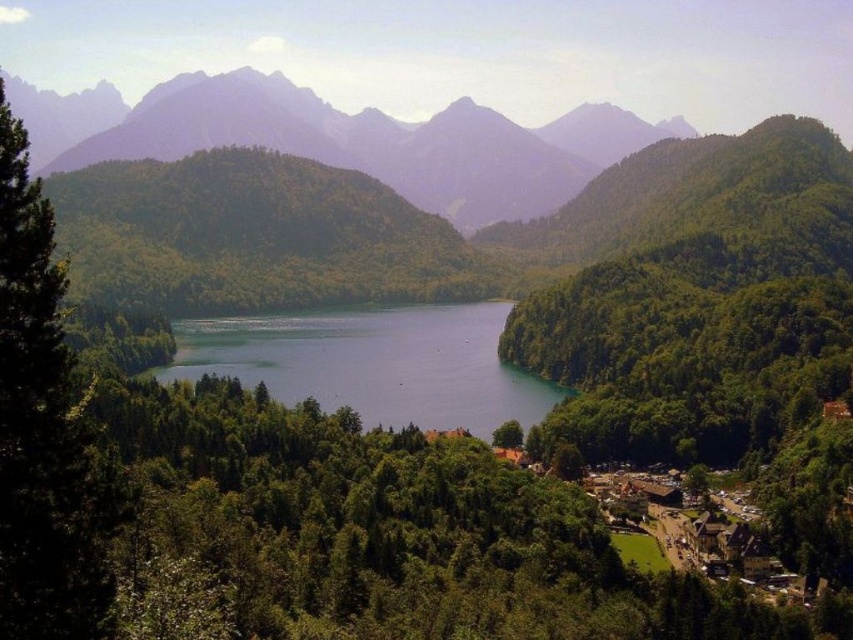
You are standing at the edge of the lake and see the rugged granite mountain at upper center and the green leafy tree at lower center. Which object is closer to you?

The green leafy tree at lower center is closer to you because the rugged granite mountain at upper center is further away.